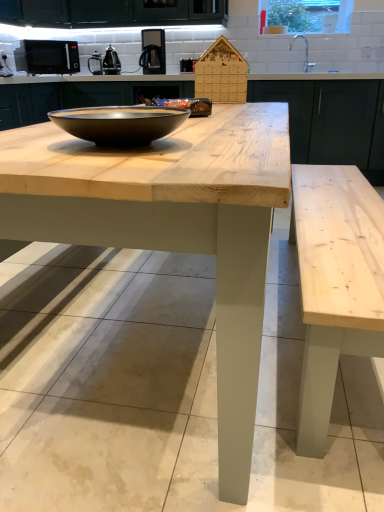
Question: From the image's perspective, is black matte microwave at upper left, placed as the 1th appliance when sorted from left to right, on top of metallic silver kettle at upper center, placed as the 2th appliance when sorted from left to right?

Choices:
 (A) yes
 (B) no

Answer: (A)

Question: Considering the relative sizes of black matte microwave at upper left, the second appliance in the right-to-left sequence, and metallic silver kettle at upper center, placed as the 2th appliance when sorted from left to right, in the image provided, is black matte microwave at upper left, the second appliance in the right-to-left sequence, thinner than metallic silver kettle at upper center, placed as the 2th appliance when sorted from left to right,?

Choices:
 (A) no
 (B) yes

Answer: (A)

Question: Can you confirm if black matte microwave at upper left, placed as the 1th appliance when sorted from left to right, is wider than metallic silver kettle at upper center, positioned as the 1th appliance in right-to-left order?

Choices:
 (A) no
 (B) yes

Answer: (B)

Question: From a real-world perspective, is black matte microwave at upper left, the second appliance in the right-to-left sequence, on metallic silver kettle at upper center, positioned as the 1th appliance in right-to-left order?

Choices:
 (A) no
 (B) yes

Answer: (B)

Question: Does black matte microwave at upper left, the second appliance in the right-to-left sequence, lie behind metallic silver kettle at upper center, positioned as the 1th appliance in right-to-left order?

Choices:
 (A) yes
 (B) no

Answer: (B)

Question: Which is correct: transparent glass window screen at upper right is inside metallic silver kettle at upper center, positioned as the 1th appliance in right-to-left order, or outside of it?

Choices:
 (A) inside
 (B) outside

Answer: (B)

Question: Considering their positions, is transparent glass window screen at upper right located in front of or behind metallic silver kettle at upper center, placed as the 2th appliance when sorted from left to right?

Choices:
 (A) behind
 (B) front

Answer: (A)

Question: In the image, is transparent glass window screen at upper right on the left side or the right side of metallic silver kettle at upper center, placed as the 2th appliance when sorted from left to right?

Choices:
 (A) right
 (B) left

Answer: (A)

Question: Is point (332, 31) closer or farther from the camera than point (112, 53)?

Choices:
 (A) farther
 (B) closer

Answer: (B)

Question: Is point (21, 50) positioned closer to the camera than point (236, 406)?

Choices:
 (A) closer
 (B) farther

Answer: (B)

Question: Is black matte microwave at upper left, the second appliance in the right-to-left sequence, taller or shorter than natural wood table at center?

Choices:
 (A) short
 (B) tall

Answer: (A)

Question: Considering their positions, is black matte microwave at upper left, placed as the 1th appliance when sorted from left to right, located in front of or behind natural wood table at center?

Choices:
 (A) front
 (B) behind

Answer: (B)

Question: Considering the positions of black matte microwave at upper left, placed as the 1th appliance when sorted from left to right, and natural wood table at center in the image, is black matte microwave at upper left, placed as the 1th appliance when sorted from left to right, wider or thinner than natural wood table at center?

Choices:
 (A) wide
 (B) thin

Answer: (B)

Question: Considering the positions of transparent glass window screen at upper right and satin black coffee machine at upper center in the image, is transparent glass window screen at upper right wider or thinner than satin black coffee machine at upper center?

Choices:
 (A) thin
 (B) wide

Answer: (A)

Question: In terms of height, does transparent glass window screen at upper right look taller or shorter compared to satin black coffee machine at upper center?

Choices:
 (A) short
 (B) tall

Answer: (A)